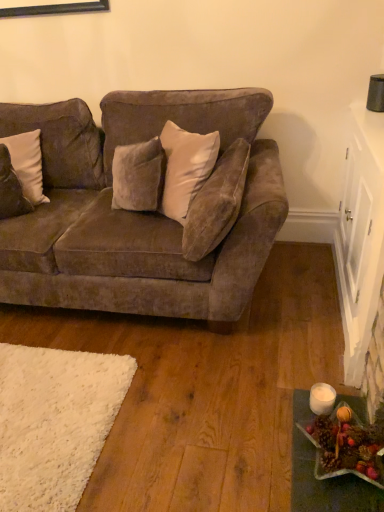
Question: Is white velvet pillow at left, acting as the first pillow starting from the left, taller or shorter than velvet beige pillow at center, which is the second pillow from left to right?

Choices:
 (A) tall
 (B) short

Answer: (B)

Question: From the image's perspective, is white velvet pillow at left, acting as the first pillow starting from the left, above or below velvet beige pillow at center, the 1th pillow in the right-to-left sequence?

Choices:
 (A) above
 (B) below

Answer: (A)

Question: Considering the real-world distances, which object is farthest from the shiny metallic star at lower right?

Choices:
 (A) velvet brown couch at left
 (B) white velvet pillow at left, acting as the first pillow starting from the left
 (C) velvet beige pillow at center, the 1th pillow in the right-to-left sequence

Answer: (B)

Question: Which of these objects is positioned farthest from the velvet beige pillow at center, which is the second pillow from left to right?

Choices:
 (A) shiny metallic star at lower right
 (B) white velvet pillow at left, acting as the first pillow starting from the left
 (C) velvet brown couch at left

Answer: (B)